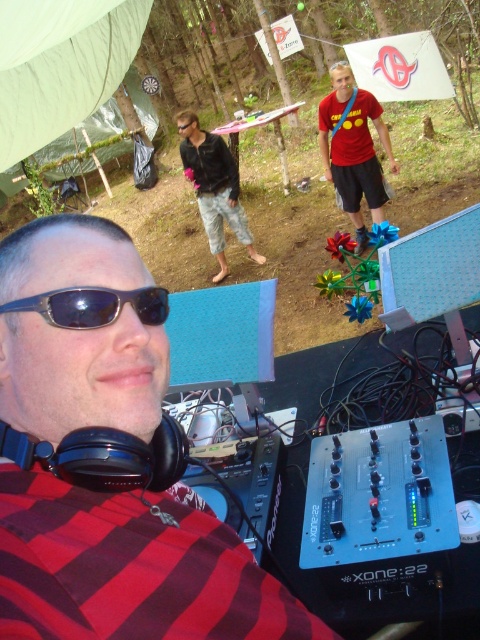
Question: Is denim shorts at center thinner than sunglasses at center?

Choices:
 (A) yes
 (B) no

Answer: (B)

Question: Which point is closer to the camera?

Choices:
 (A) denim shorts at center
 (B) black matte headphones at lower left

Answer: (B)

Question: Does black matte headphones at lower left appear over sunglasses at center?

Choices:
 (A) yes
 (B) no

Answer: (B)

Question: Which object is positioned farthest from the sunglasses at center?

Choices:
 (A) black matte headphones at lower left
 (B) denim shorts at center
 (C) black plastic goggles at center
 (D) matte red t-shirt at center

Answer: (C)

Question: Does black matte headphones at lower left come in front of sunglasses at center?

Choices:
 (A) yes
 (B) no

Answer: (A)

Question: Which object is positioned closest to the black matte headphones at lower left?

Choices:
 (A) black plastic goggles at center
 (B) denim shorts at center

Answer: (B)